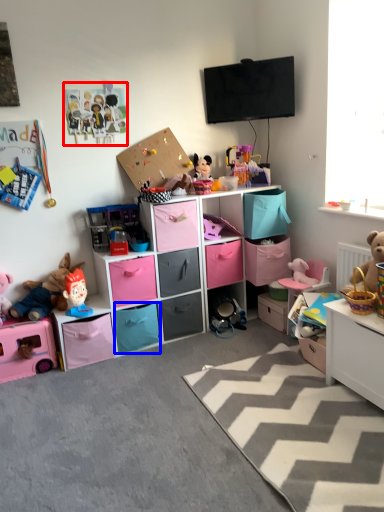
Question: Which point is closer to the camera, toy (highlighted by a red box) or drawer (highlighted by a blue box)?

Choices:
 (A) toy
 (B) drawer

Answer: (A)